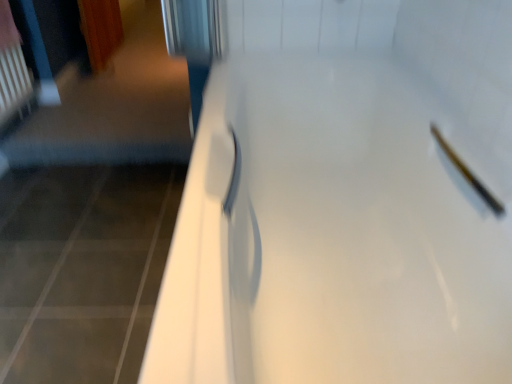
Question: Is the surface of white glossy door at center in direct contact with matte white showerhead at upper right?

Choices:
 (A) no
 (B) yes

Answer: (A)

Question: Does white glossy door at center lie in front of matte white showerhead at upper right?

Choices:
 (A) yes
 (B) no

Answer: (A)

Question: Does white glossy door at center come behind matte white showerhead at upper right?

Choices:
 (A) no
 (B) yes

Answer: (A)

Question: Considering the relative sizes of white glossy door at center and matte white showerhead at upper right in the image provided, is white glossy door at center thinner than matte white showerhead at upper right?

Choices:
 (A) yes
 (B) no

Answer: (B)

Question: Does white glossy door at center appear on the right side of matte white showerhead at upper right?

Choices:
 (A) no
 (B) yes

Answer: (A)

Question: From a real-world perspective, is white glossy door at center under matte white showerhead at upper right?

Choices:
 (A) no
 (B) yes

Answer: (B)

Question: Does matte white showerhead at upper right contain white glossy door at center?

Choices:
 (A) no
 (B) yes

Answer: (A)

Question: Is matte white showerhead at upper right shorter than white glossy door at center?

Choices:
 (A) no
 (B) yes

Answer: (B)

Question: From the image's perspective, does matte white showerhead at upper right appear lower than white glossy door at center?

Choices:
 (A) yes
 (B) no

Answer: (B)

Question: Does matte white showerhead at upper right appear on the left side of white glossy door at center?

Choices:
 (A) no
 (B) yes

Answer: (A)

Question: Are matte white showerhead at upper right and white glossy door at center located far from each other?

Choices:
 (A) yes
 (B) no

Answer: (B)

Question: From the image's perspective, is matte white showerhead at upper right over white glossy door at center?

Choices:
 (A) yes
 (B) no

Answer: (A)

Question: From the image's perspective, is matte white showerhead at upper right above or below white glossy door at center?

Choices:
 (A) below
 (B) above

Answer: (B)